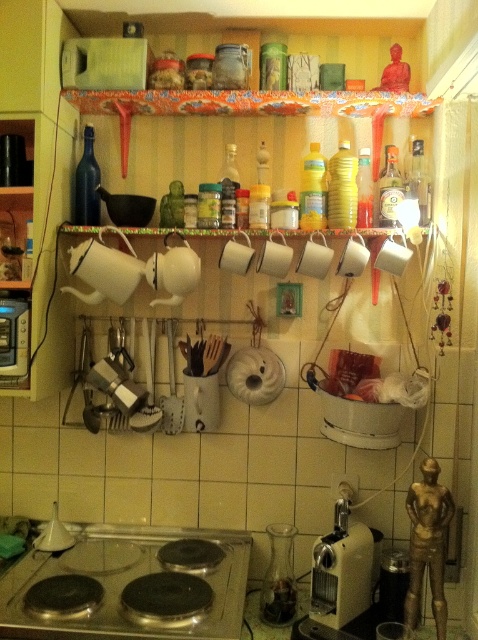
From the picture: You are preparing to place a large pot on the kitchen counter. You see the black glass stove at lower center and the metallic beige coffee machine at lower center. Which one should you avoid placing the pot on to ensure it fits properly?

You should avoid placing the pot on the metallic beige coffee machine at lower center because the black glass stove at lower center has a larger size and can accommodate the pot more appropriately.

You are a chef standing at the kitchen counter. You need to reach the black glass stove at lower center to adjust the heat. Your arm can reach up to 1.2 meters. Can you reach it?

The black glass stove at lower center and camera are 1.33 meters apart. Since your arm can only reach up to 1.2 meters, you cannot reach the black glass stove at lower center.